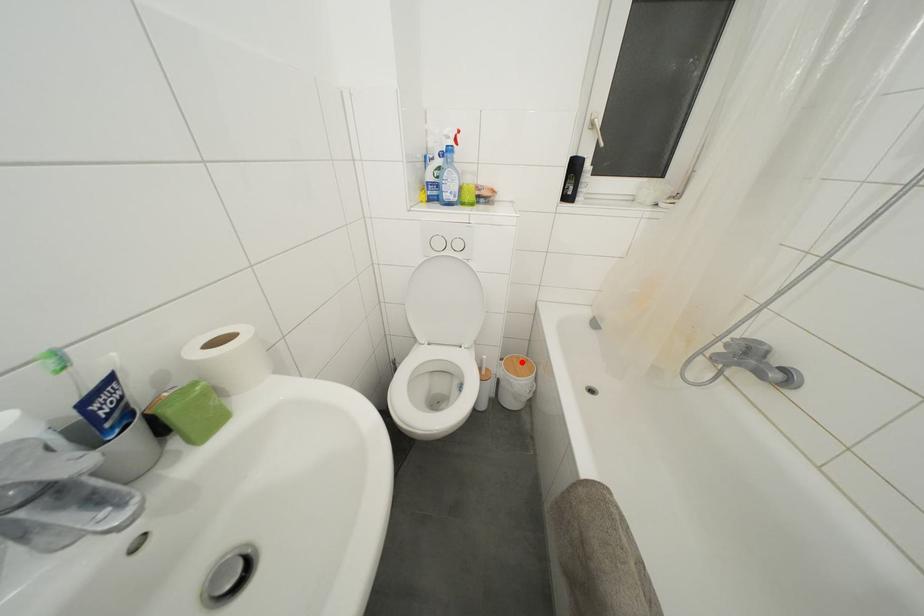
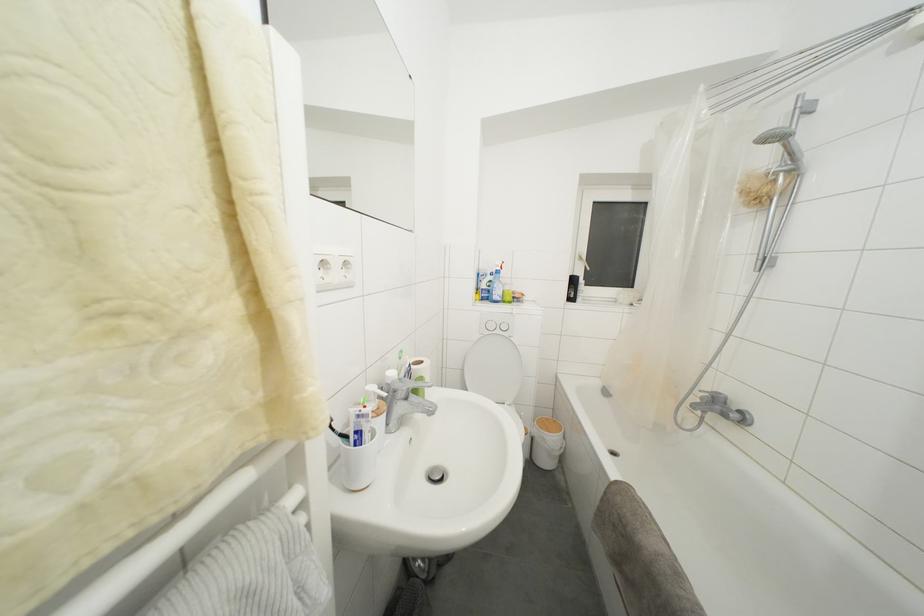
Question: I am providing you with two images of the same scene from different viewpoints. Image1 has a red point marked. In image2, the corresponding 3D location appears at what relative position? Reply with the corresponding letter.

Choices:
 (A) Closer
 (B) Farther

Answer: (B)